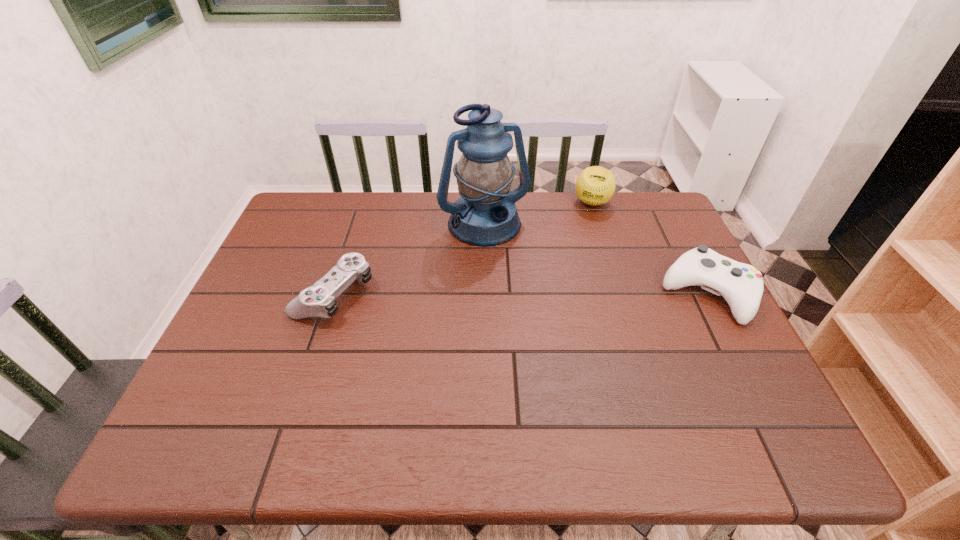
Image resolution: width=960 pixels, height=540 pixels. What are the coordinates of `free space that is in between the right control and the left control` in the screenshot? It's located at (521, 293).

Find the location of a particular element. This screenshot has width=960, height=540. free space between the left control and the softball is located at coordinates (463, 248).

Identify the location of vacant region between the second object from right to left and the rightmost object. The width and height of the screenshot is (960, 540). (650, 248).

Where is `vacant space that is in between the rightmost object and the third object from left to right`? The image size is (960, 540). vacant space that is in between the rightmost object and the third object from left to right is located at coordinates point(650,248).

Locate which object ranks second in proximity to the lantern. Please provide its 2D coordinates. Your answer should be formatted as a tuple, i.e. [(x, y)], where the tuple contains the x and y coordinates of a point satisfying the conditions above.

[(319, 300)]

You are a GUI agent. You are given a task and a screenshot of the screen. Output one action in this format:
    pyautogui.click(x=<x>, y=<y>)
    Task: Click on the closest object to the left control
    Image resolution: width=960 pixels, height=540 pixels.
    Given the screenshot: What is the action you would take?
    pyautogui.click(x=485, y=214)

Image resolution: width=960 pixels, height=540 pixels. I want to click on free space that satisfies the following two spatial constraints: 1. on the back side of the second object from left to right; 2. on the left side of the softball, so click(484, 202).

Where is `vacant area in the image that satisfies the following two spatial constraints: 1. on the back side of the left control; 2. on the right side of the third object from left to right`? vacant area in the image that satisfies the following two spatial constraints: 1. on the back side of the left control; 2. on the right side of the third object from left to right is located at coordinates (365, 202).